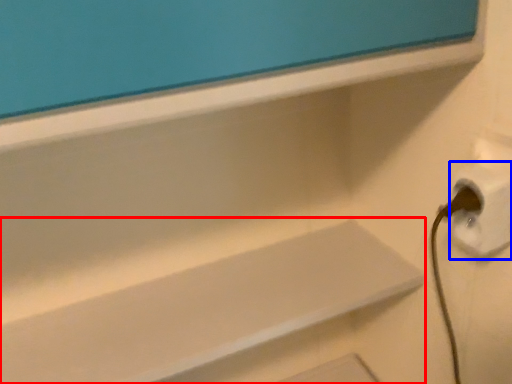
Question: Among these objects, which one is farthest to the camera, shelf (highlighted by a red box) or electric outlet (highlighted by a blue box)?

Choices:
 (A) shelf
 (B) electric outlet

Answer: (A)